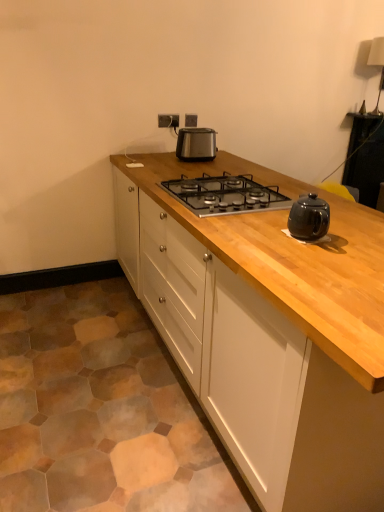
Question: Is natural wood cabinet at center oriented towards black glass gas stove at center?

Choices:
 (A) no
 (B) yes

Answer: (A)

Question: Is natural wood cabinet at center taller than black glass gas stove at center?

Choices:
 (A) no
 (B) yes

Answer: (B)

Question: Does natural wood cabinet at center have a smaller size compared to black glass gas stove at center?

Choices:
 (A) yes
 (B) no

Answer: (B)

Question: From a real-world perspective, is natural wood cabinet at center below black glass gas stove at center?

Choices:
 (A) yes
 (B) no

Answer: (A)

Question: Is natural wood cabinet at center wider than black glass gas stove at center?

Choices:
 (A) no
 (B) yes

Answer: (B)

Question: From a real-world perspective, is natural wood cabinet at center on top of black glass gas stove at center?

Choices:
 (A) no
 (B) yes

Answer: (A)

Question: From the image's perspective, is satin black toaster at center above black glass gas stove at center?

Choices:
 (A) no
 (B) yes

Answer: (B)

Question: From a real-world perspective, is satin black toaster at center physically below black glass gas stove at center?

Choices:
 (A) no
 (B) yes

Answer: (A)

Question: Is satin black toaster at center next to black glass gas stove at center and touching it?

Choices:
 (A) no
 (B) yes

Answer: (A)

Question: Is satin black toaster at center positioned with its back to black glass gas stove at center?

Choices:
 (A) no
 (B) yes

Answer: (A)

Question: Are satin black toaster at center and black glass gas stove at center far apart?

Choices:
 (A) no
 (B) yes

Answer: (A)

Question: Considering the relative sizes of satin black toaster at center and black glass gas stove at center in the image provided, is satin black toaster at center taller than black glass gas stove at center?

Choices:
 (A) no
 (B) yes

Answer: (B)

Question: Is natural wood cabinet at center located within satin silver outlet at upper center?

Choices:
 (A) no
 (B) yes

Answer: (A)